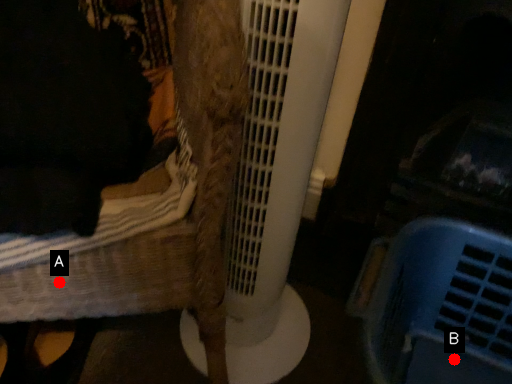
Question: Two points are circled on the image, labeled by A and B beside each circle. Which point is closer to the camera?

Choices:
 (A) A is closer
 (B) B is closer

Answer: (A)